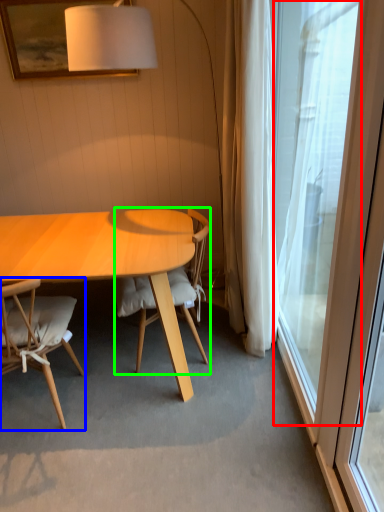
Question: Considering the real-world distances, which object is farthest from window (highlighted by a red box)? chair (highlighted by a blue box) or chair (highlighted by a green box)?

Choices:
 (A) chair
 (B) chair

Answer: (A)